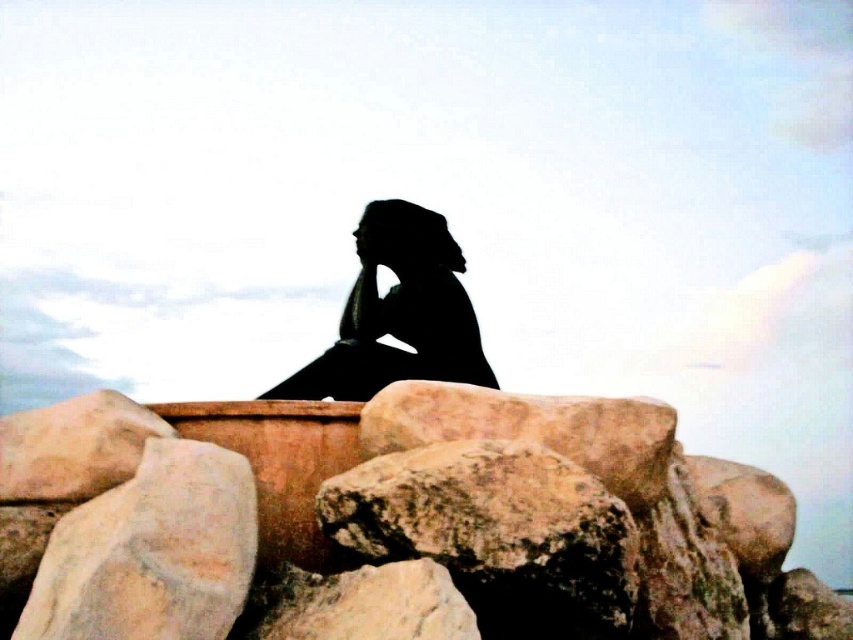
Is point (209, 614) behind point (483, 358)?

That is False.

Is rustic stone at lower left to the right of black matte figure at center from the viewer's perspective?

No, rustic stone at lower left is not to the right of black matte figure at center.

Which is in front, point (200, 612) or point (329, 358)?

Positioned in front is point (200, 612).

You are a GUI agent. You are given a task and a screenshot of the screen. Output one action in this format:
    pyautogui.click(x=<x>, y=<y>)
    Task: Click on the rustic stone at lower left
    This screenshot has height=640, width=853.
    Given the screenshot: What is the action you would take?
    pyautogui.click(x=151, y=552)